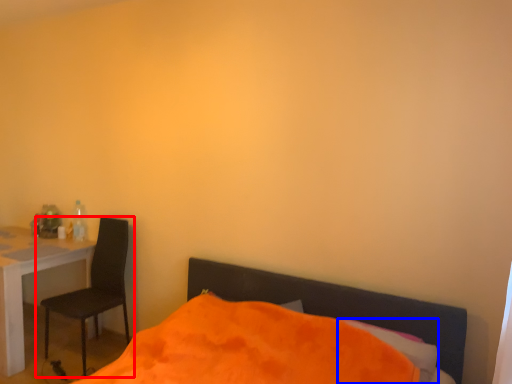
Question: Which object is closer to the camera taking this photo, chair (highlighted by a red box) or pillow (highlighted by a blue box)?

Choices:
 (A) chair
 (B) pillow

Answer: (B)